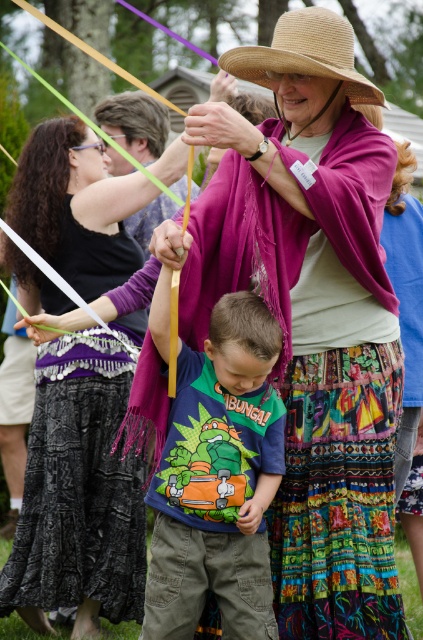
You are standing in the park and see the purple scarf at center. Can you estimate its position relative to the center of the image?

The purple scarf at center is located at point 0.781 on the x axis and 0.187 on the y axis, which is slightly to the right and lower than the exact center of the image.

You are a photographer trying to capture a photo of the black textured skirt at lower left and the straw hat at upper center in the scene. The camera you are using has a maximum focus range of 10 feet. Can you take a photo that includes both objects without moving the camera?

The black textured skirt at lower left and the straw hat at upper center are 9.77 feet apart, which is within the camera maximum focus range of 10 feet. Yes, you can take a photo that includes both objects without moving the camera.

In the scene, there is a straw hat at center and a black textured skirt at lower left. Which object is bigger in size?

The straw hat at center is larger in size compared to the black textured skirt at lower left.